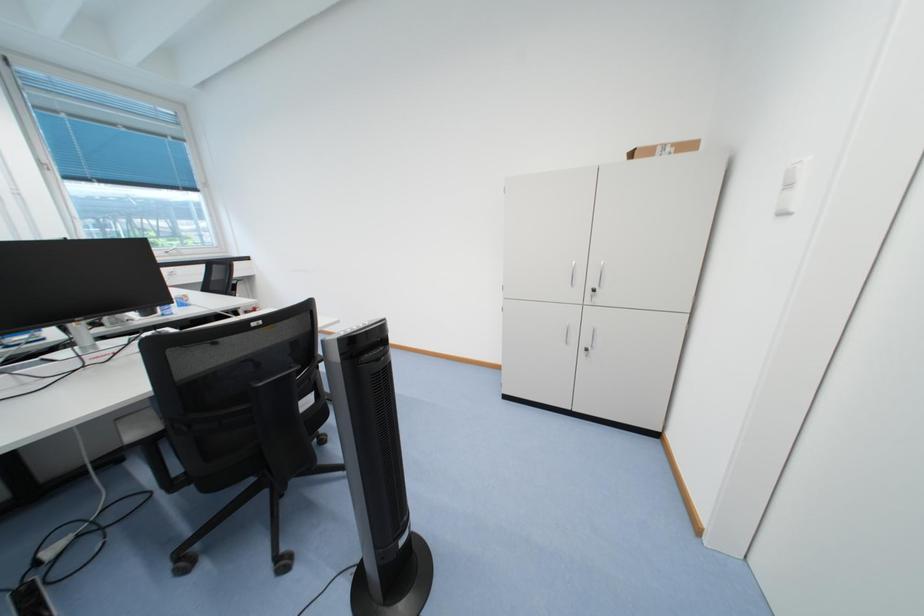
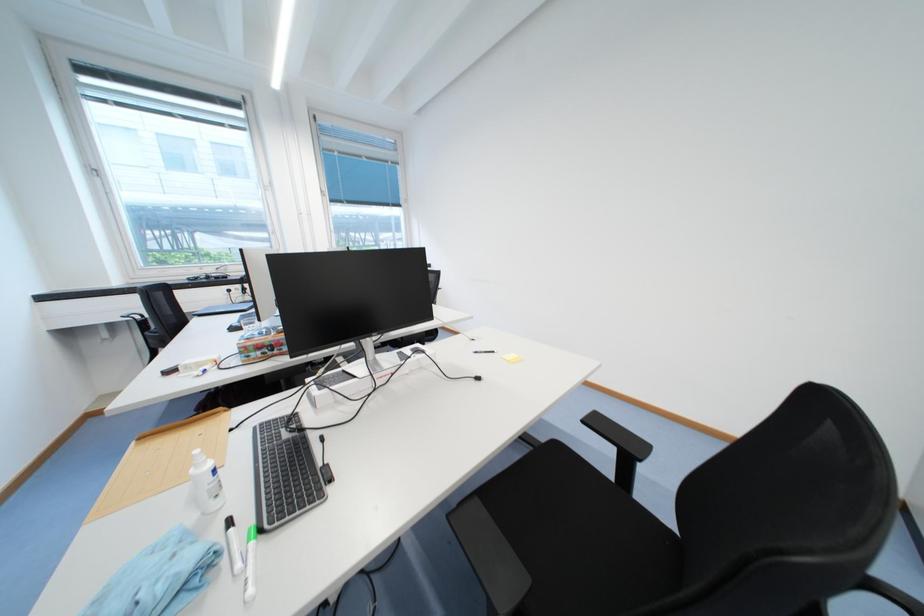
Question: Which direction would the cameraman need to move to produce the second image? Reply with the corresponding letter.

Choices:
 (A) Left
 (B) Right
 (C) Forward
 (D) Backward

Answer: (A)